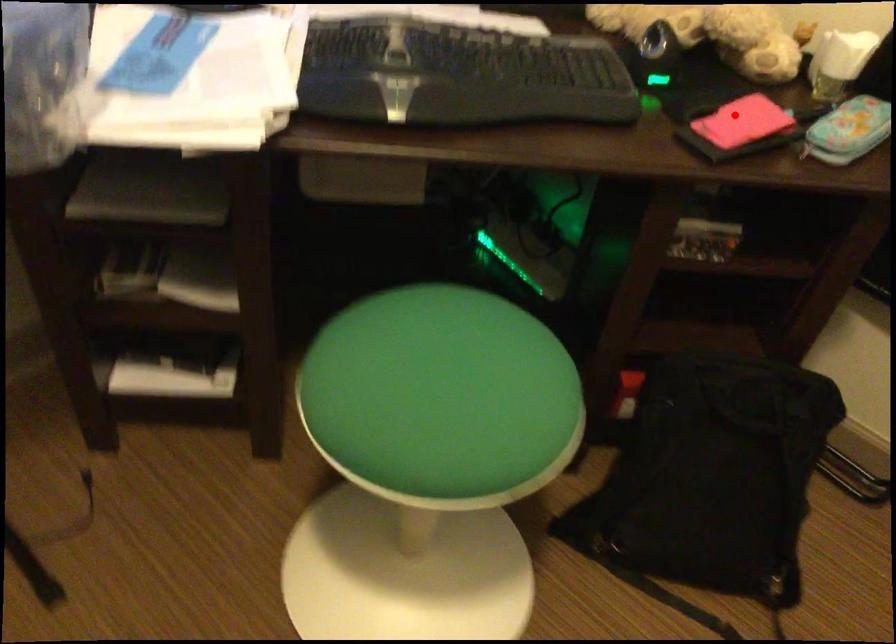
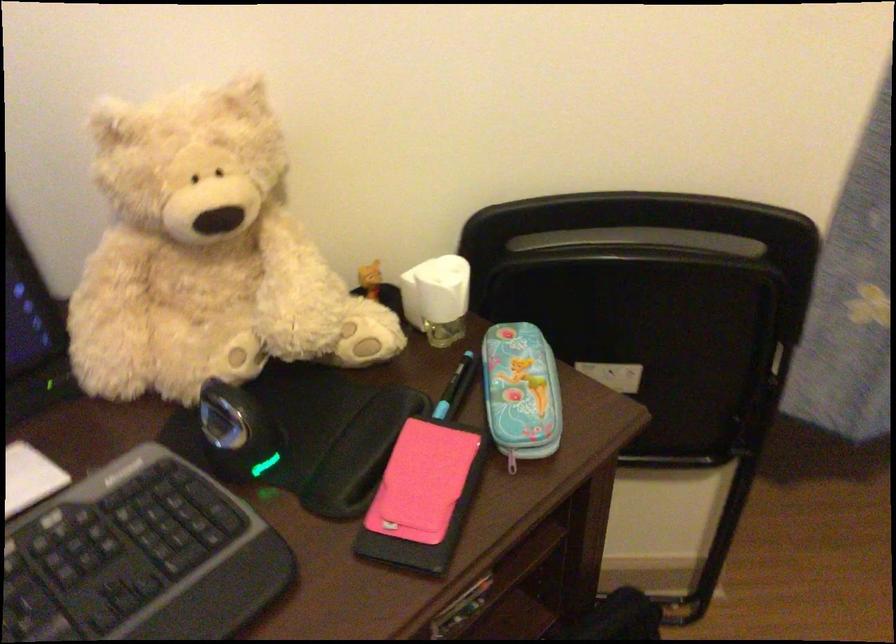
The point at the highlighted location is marked in the first image. Where is the corresponding point in the second image?

(421, 482)